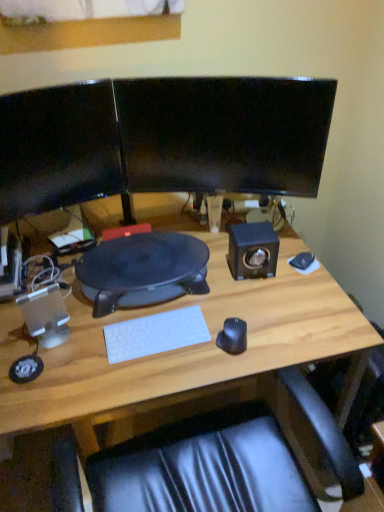
I want to click on vacant space that is to the left of white matte keyboard at center, so click(x=86, y=342).